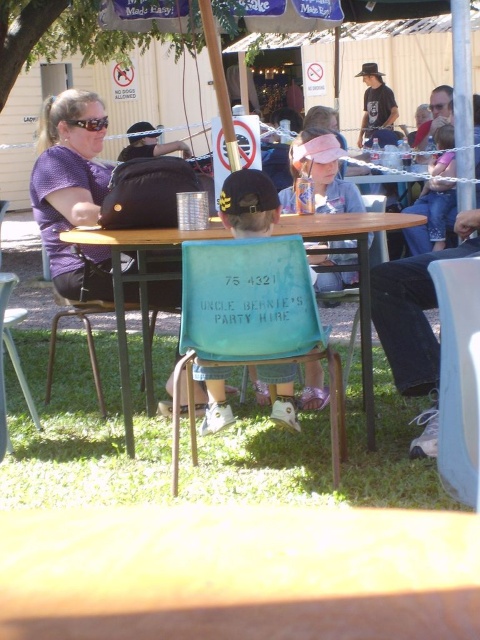
You are a caterer setting up a buffet table at Uncle Bernie party. You have a 3 feet long platter that needs to be placed between the wooden table at center and the blue plastic chair at lower right. Can the platter fit between them?

The wooden table at center and blue plastic chair at lower right are 3.36 feet apart, so the 3 feet long platter can fit between them since the distance is greater than the platter length.

You are at a party and want to find the wooden table at center. Which direction should you look relative to the matte purple shirt at left?

The wooden table at center is to the right of the matte purple shirt at left.

You are standing at the event and want to take a photo of the matte purple shirt at left and the wooden table at center. Which object should you focus on first if you need to adjust your camera focus for closer objects first?

The matte purple shirt at left is closer to you than the wooden table at center, so you should focus on the matte purple shirt at left first.